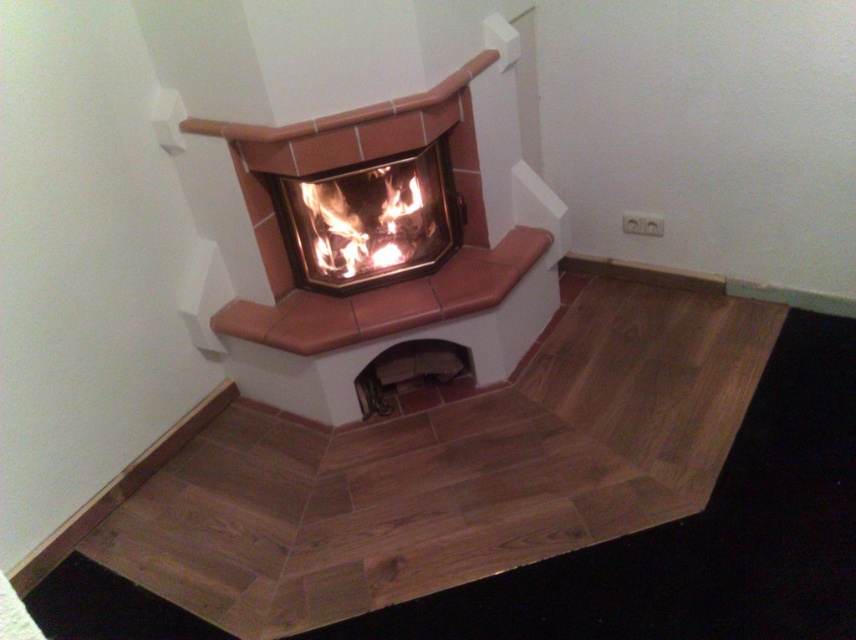
Question: Can you confirm if matte ceramic fireplace at center is positioned above metallic dark gray vent at lower center?

Choices:
 (A) yes
 (B) no

Answer: (A)

Question: Can you confirm if terracotta tile fireplace at center is positioned to the right of flaming wood at center?

Choices:
 (A) no
 (B) yes

Answer: (B)

Question: Which of the following is the closest to the observer?

Choices:
 (A) metallic dark gray vent at lower center
 (B) flaming wood at center
 (C) terracotta tile fireplace at center

Answer: (C)

Question: Which of these objects is positioned farthest from the metallic dark gray vent at lower center?

Choices:
 (A) matte ceramic fireplace at center
 (B) flaming wood at center

Answer: (B)

Question: Which point is closer to the camera taking this photo?

Choices:
 (A) (426, 346)
 (B) (385, 188)

Answer: (B)

Question: Is flaming wood at center wider than metallic dark gray vent at lower center?

Choices:
 (A) yes
 (B) no

Answer: (A)